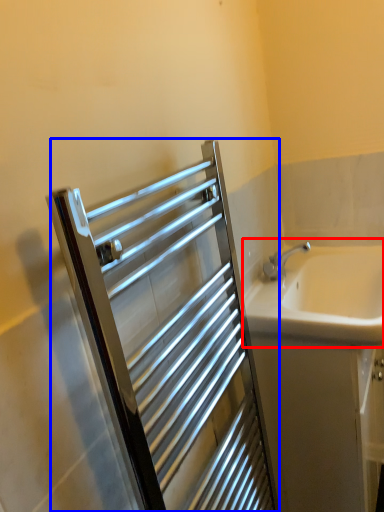
Question: Which object is closer to the camera taking this photo, sink (highlighted by a red box) or screen door (highlighted by a blue box)?

Choices:
 (A) sink
 (B) screen door

Answer: (B)